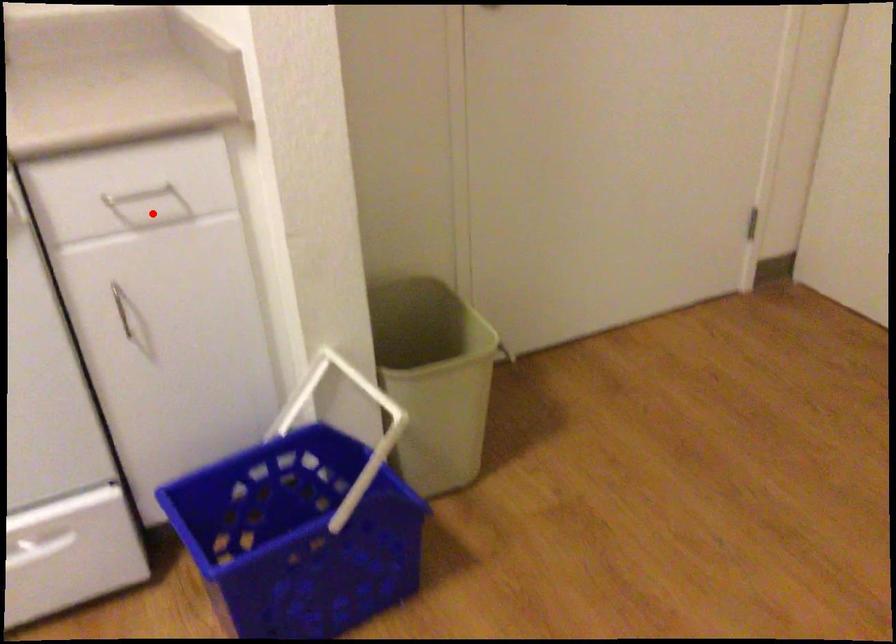
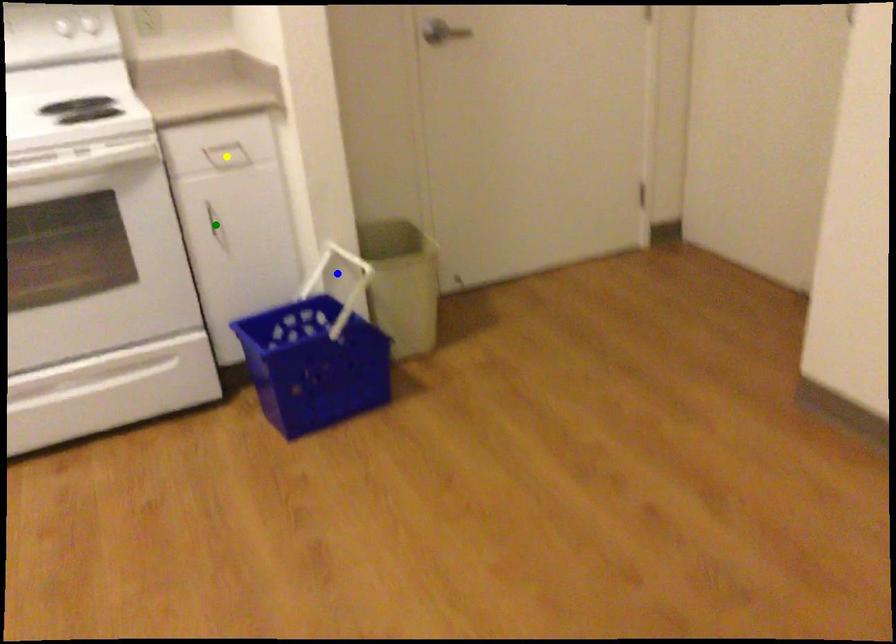
Question: I am providing you with two images of the same scene from different viewpoints. A red point is marked on the first image. You are given multiple points on the second image. Which point in image 2 is actually the same real-world point as the red point in image 1?

Choices:
 (A) yellow point
 (B) blue point
 (C) green point

Answer: (A)